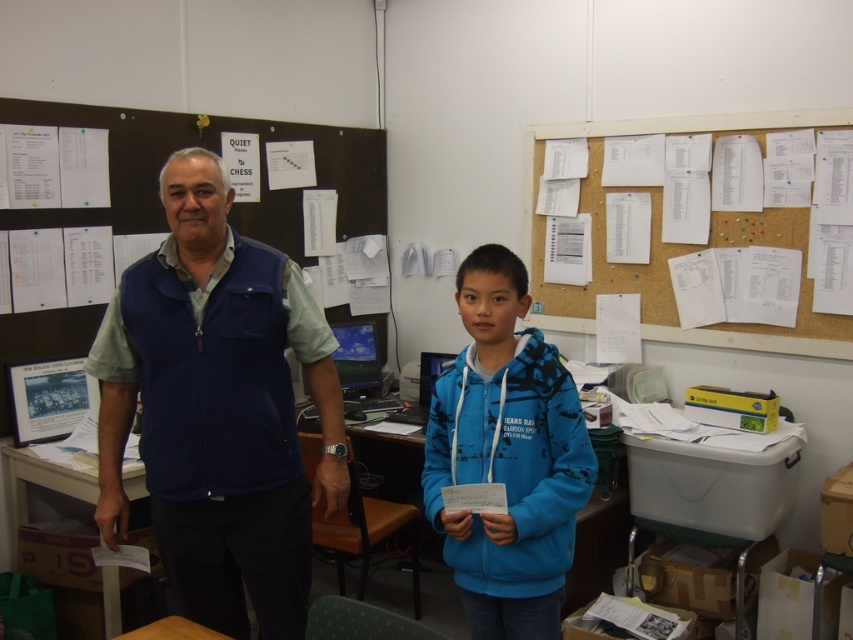
You are an observer in the room and want to touch both the blue fleece vest at center and the blue fleece jacket at center. Which one can you reach first without moving your position?

The blue fleece vest at center is closer to you, so you can reach it first.

You are organizing a classroom event and need to place a 1.2 meter long banner on the white plastic table at center. Considering the size of the blue fleece jacket at center, will the banner fit on the table without overlapping it?

The blue fleece jacket at center is smaller than the white plastic table at center, so the banner can be placed on the table without overlapping the jacket as long as there is enough space on the table.